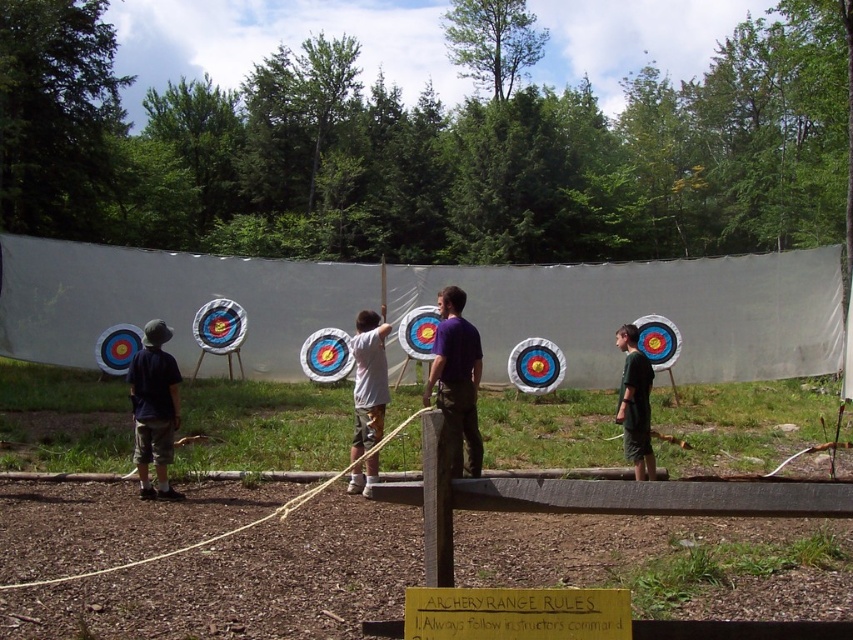
Question: Estimate the real-world distances between objects in this image. Which object is farther from the dark blue shirt at left?

Choices:
 (A) dark green shorts at center
 (B) purple cotton shirt at center

Answer: (A)

Question: Is purple cotton shirt at center smaller than dark blue shirt at left?

Choices:
 (A) no
 (B) yes

Answer: (A)

Question: In this image, where is purple cotton shirt at center located relative to white cotton shirt at center?

Choices:
 (A) above
 (B) below

Answer: (A)

Question: Which point is farther to the camera?

Choices:
 (A) dark green shorts at center
 (B) white cotton shirt at center
 (C) purple cotton shirt at center
 (D) dark blue shirt at left

Answer: (A)

Question: Which of the following is the farthest from the observer?

Choices:
 (A) purple cotton shirt at center
 (B) dark green shorts at center

Answer: (B)

Question: Does purple cotton shirt at center appear on the right side of dark green shorts at center?

Choices:
 (A) no
 (B) yes

Answer: (A)